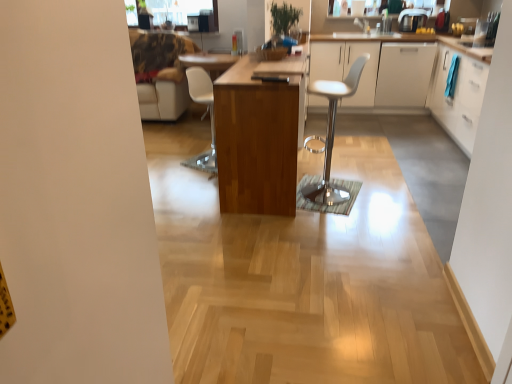
Question: Considering the positions of point (150, 0) and point (484, 86), is point (150, 0) closer or farther from the camera than point (484, 86)?

Choices:
 (A) closer
 (B) farther

Answer: (B)

Question: From a real-world perspective, is transparent glass window screen at upper center physically located above or below white glossy cabinet at right, the 1th cabinetry positioned from the right?

Choices:
 (A) below
 (B) above

Answer: (B)

Question: Based on their relative distances, which object is farther from the white plastic chair at center, positioned as the second chair in right-to-left order?

Choices:
 (A) metallic silver coffee maker at upper right
 (B) white glossy cabinet at right, the 1th cabinetry positioned from the right
 (C) wooden table at center
 (D) white glossy cabinet at upper right, which is the third cabinetry from right to left
 (E) white matte cabinet at right, which appears as the 3th cabinetry when viewed from the left

Answer: (A)

Question: Estimate the real-world distances between objects in this image. Which object is closer to the transparent glass window screen at upper center?

Choices:
 (A) velvet brown couch at upper left
 (B) white plastic chair at center, the first chair from the back
 (C) white leather stool at center, the 1th chair viewed from the front
 (D) white matte cabinet at right, which appears as the 3th cabinetry when viewed from the left
 (E) white glossy cabinet at upper right, which is the third cabinetry from right to left

Answer: (A)